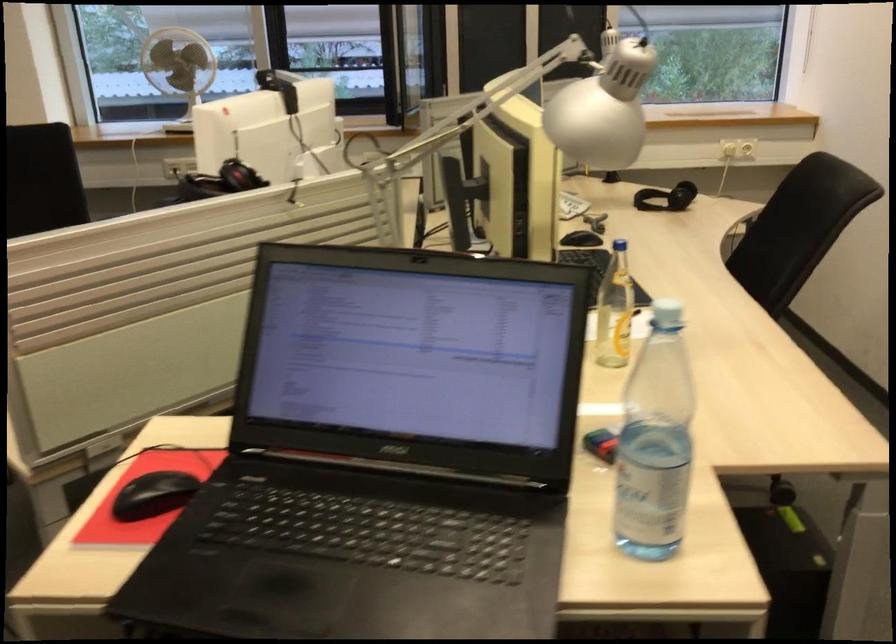
Find where to twist the white bottle cap. Please return your answer as a coordinate pair (x, y).

(666, 313)